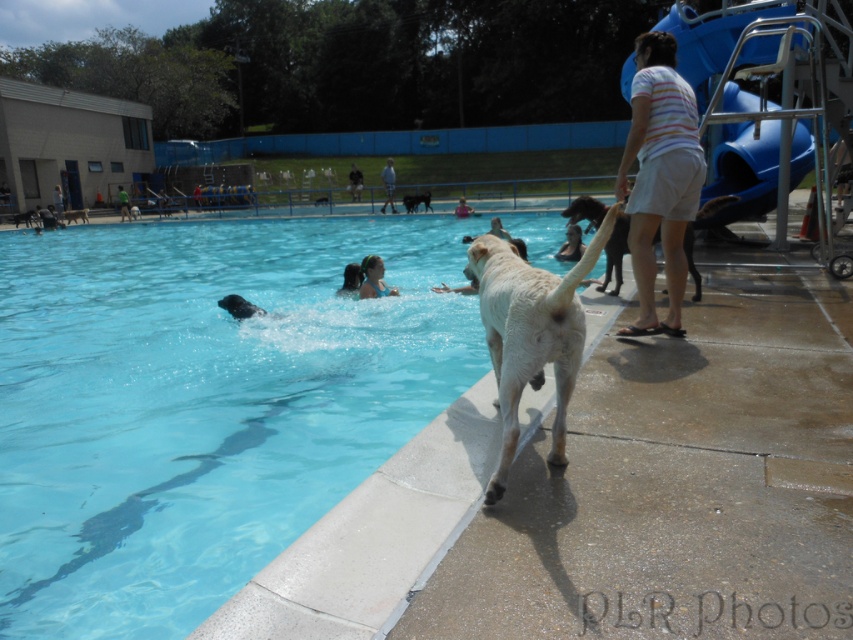
You are a photographer at the poolside. You want to capture a photo of the golden fur dog at center and the smooth skin person at upper center. Based on their positions, which one should be placed to the right side of the frame to ensure both are visible?

The golden fur dog at center is already positioned on the right side of the smooth skin person at upper center, so placing the dog on the right side of the frame would ensure both are visible.

Looking at this image, you are a photographer trying to capture a photo of the white fur dog at upper left and the white striped shirt at upper right. From your current position, which object is positioned higher in the frame?

The white fur dog at upper left is positioned higher in the frame than the white striped shirt at upper right.

You are a photographer at the pool and want to take a photo of the white striped shirt at upper right and the white fur dog at upper left. Which object is positioned closer to the camera?

The white striped shirt at upper right is closer to the camera than the white fur dog at upper left.